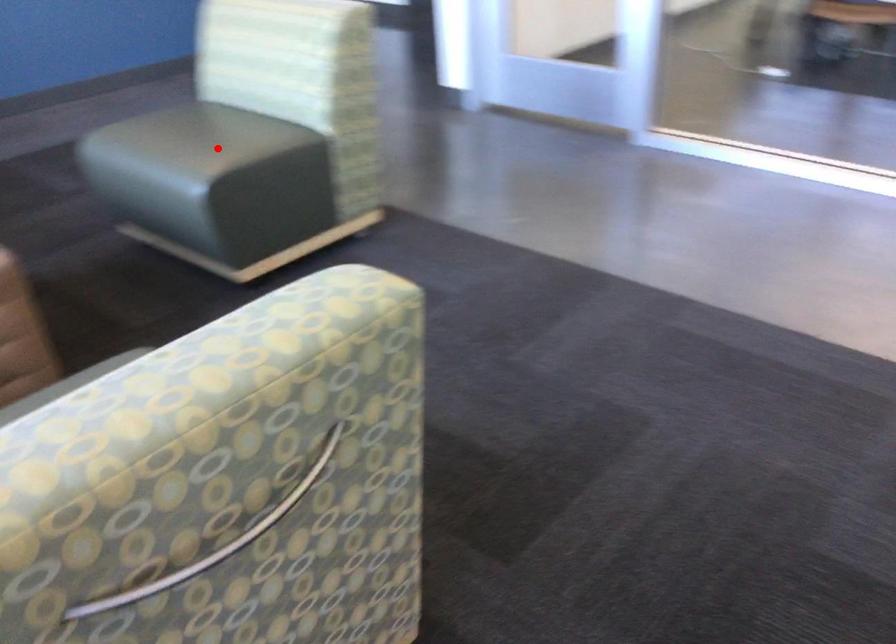
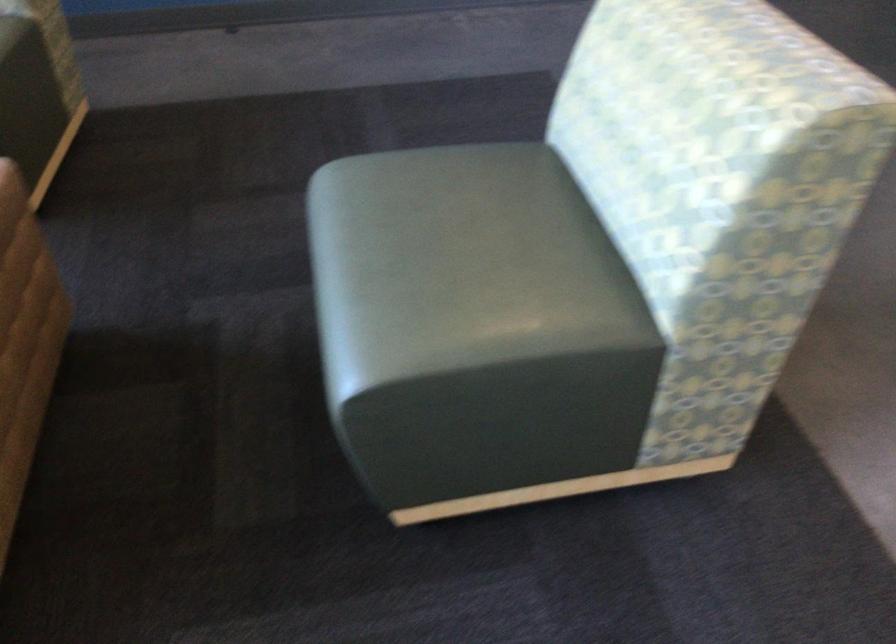
Question: I am providing you with two images of the same scene from different viewpoints. Given a red point in image1, look at the same physical point in image2. Is it:

Choices:
 (A) Closer to the viewpoint
 (B) Farther from the viewpoint

Answer: (A)